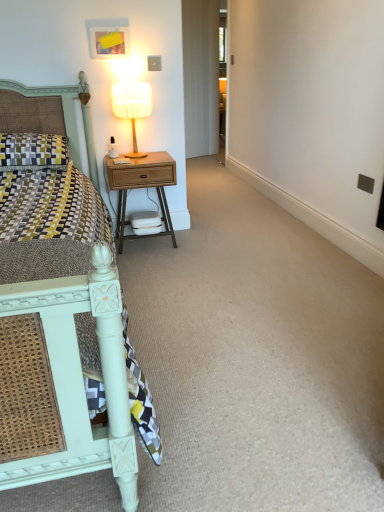
You are a GUI agent. You are given a task and a screenshot of the screen. Output one action in this format:
    pyautogui.click(x=<x>, y=<y>)
    Task: Click on the vacant region below white fabric lampshade at upper right (from a real-world perspective)
    Image resolution: width=384 pixels, height=512 pixels.
    Given the screenshot: What is the action you would take?
    pyautogui.click(x=141, y=153)